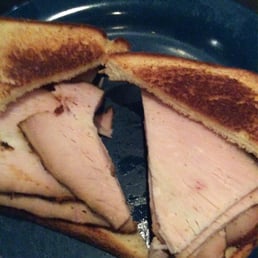
The image size is (258, 258). I want to click on plate, so click(245, 21).